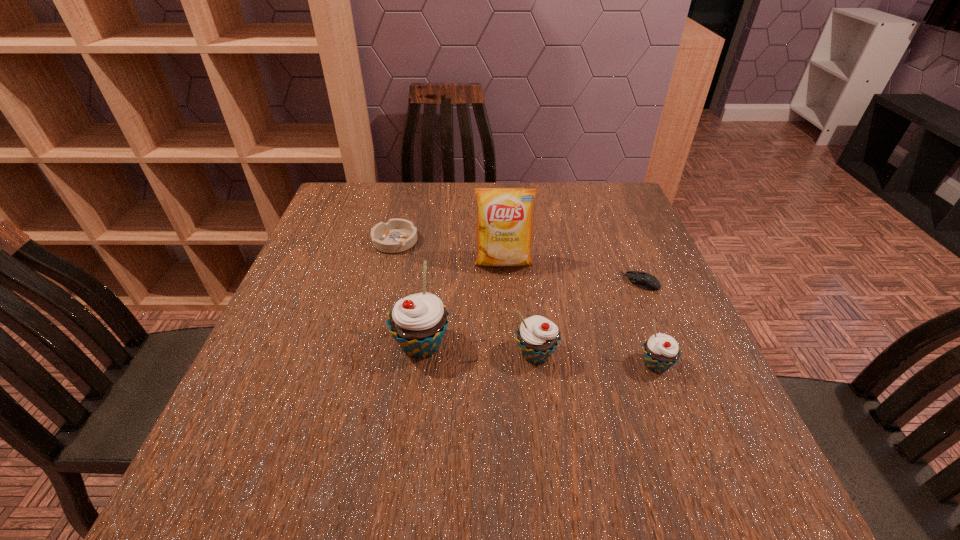
Locate an element on the screen. This screenshot has width=960, height=540. free space at the far left corner of the desktop is located at coordinates pyautogui.click(x=353, y=214).

Locate an element on the screen. The image size is (960, 540). free point at the near left corner is located at coordinates (271, 410).

The height and width of the screenshot is (540, 960). In the image, there is a desktop. In order to click on vacant space at the far right corner in this screenshot , I will do `click(629, 203)`.

Where is `unoccupied area between the rightmost cupcake and the fourth shortest object`? unoccupied area between the rightmost cupcake and the fourth shortest object is located at coordinates (596, 360).

In order to click on vacant region between the computer mouse and the second shortest cupcake in this screenshot , I will do `click(588, 318)`.

I want to click on free space between the second shortest object and the shortest cupcake, so pos(525,303).

Locate an element on the screen. vacant region between the fifth tallest object and the second shortest cupcake is located at coordinates (466, 298).

Locate an element on the screen. The image size is (960, 540). free space between the leftmost cupcake and the shortest object is located at coordinates (531, 313).

Locate an element on the screen. The height and width of the screenshot is (540, 960). empty space between the computer mouse and the tallest cupcake is located at coordinates 531,313.

Where is `free space between the fourth shortest object and the computer mouse`? The width and height of the screenshot is (960, 540). free space between the fourth shortest object and the computer mouse is located at coordinates (588, 318).